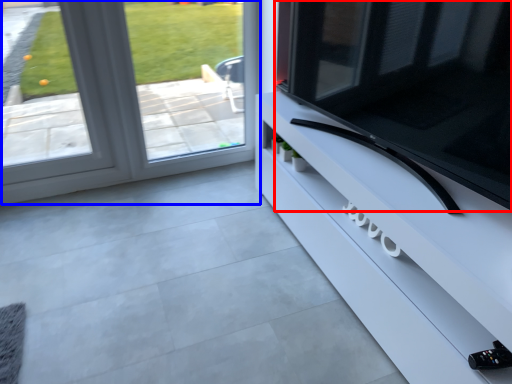
Question: Which point is closer to the camera, television (highlighted by a red box) or window (highlighted by a blue box)?

Choices:
 (A) television
 (B) window

Answer: (A)